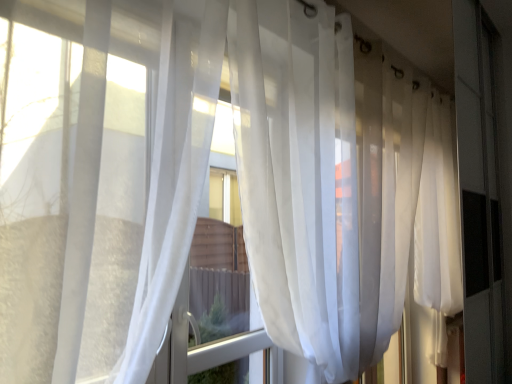
Question: In terms of size, does translucent white curtain at center, positioned as the first curtain in right-to-left order, appear bigger or smaller than translucent white curtain at left, the 1th curtain in the left-to-right sequence?

Choices:
 (A) small
 (B) big

Answer: (B)

Question: Do you think translucent white curtain at center, arranged as the 2th curtain when viewed from the left, is within translucent white curtain at left, the second curtain from the right, or outside of it?

Choices:
 (A) outside
 (B) inside

Answer: (A)

Question: Looking at their shapes, would you say translucent white curtain at center, positioned as the first curtain in right-to-left order, is wider or thinner than translucent white curtain at left, the second curtain from the right?

Choices:
 (A) wide
 (B) thin

Answer: (B)

Question: Is translucent white curtain at left, the 1th curtain in the left-to-right sequence, wider or thinner than translucent white curtain at center, positioned as the first curtain in right-to-left order?

Choices:
 (A) wide
 (B) thin

Answer: (A)

Question: Considering the positions of translucent white curtain at left, the 1th curtain in the left-to-right sequence, and translucent white curtain at center, positioned as the first curtain in right-to-left order, in the image, is translucent white curtain at left, the 1th curtain in the left-to-right sequence, taller or shorter than translucent white curtain at center, positioned as the first curtain in right-to-left order,?

Choices:
 (A) tall
 (B) short

Answer: (B)

Question: From a real-world perspective, is translucent white curtain at left, the 1th curtain in the left-to-right sequence, above or below translucent white curtain at center, positioned as the first curtain in right-to-left order?

Choices:
 (A) above
 (B) below

Answer: (A)

Question: Is translucent white curtain at left, the 1th curtain in the left-to-right sequence, in front of or behind translucent white curtain at center, positioned as the first curtain in right-to-left order, in the image?

Choices:
 (A) behind
 (B) front

Answer: (B)